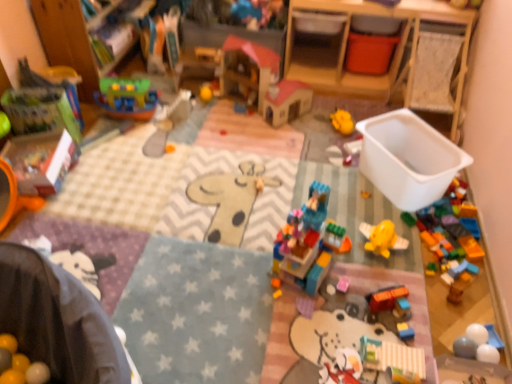
In order to click on free space in front of translucent plastic castle at center, the 8th toy from the top in this screenshot , I will do pyautogui.click(x=306, y=317).